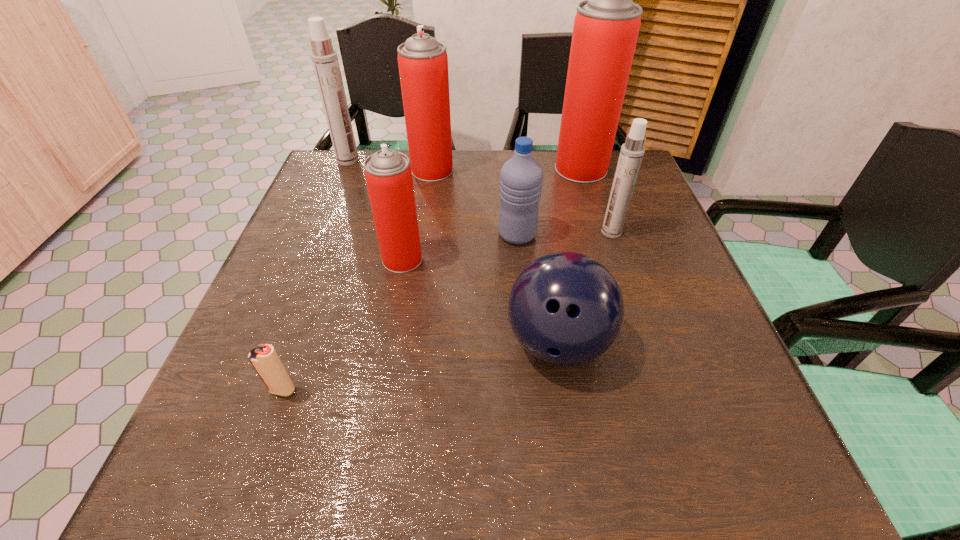
The image size is (960, 540). In order to click on vacant space at the far right corner of the desktop in this screenshot , I will do `click(644, 199)`.

I want to click on vacant space in between the seventh tallest object and the shortest object, so click(x=420, y=367).

Where is `free space between the shortest object and the nearest red aerosol can`? free space between the shortest object and the nearest red aerosol can is located at coordinates (343, 325).

At what (x,y) coordinates should I click in order to perform the action: click on blank region between the nearest aerosol can and the blue water bottle. Please return your answer as a coordinate pair (x, y). Image resolution: width=960 pixels, height=540 pixels. Looking at the image, I should click on (460, 247).

Identify the location of unoccupied position between the smallest red aerosol can and the blue water bottle. The image size is (960, 540). (460, 247).

Identify the location of vacant space that is in between the second shortest object and the bigger white aerosol can. The width and height of the screenshot is (960, 540). (453, 252).

Where is `vacant point located between the igniter and the blue water bottle`? vacant point located between the igniter and the blue water bottle is located at coordinates (399, 313).

This screenshot has height=540, width=960. I want to click on vacant point located between the blue bowling ball and the smallest red aerosol can, so click(x=480, y=301).

This screenshot has height=540, width=960. I want to click on object that is the fourth closest to the second biggest red aerosol can, so click(x=606, y=26).

The width and height of the screenshot is (960, 540). Find the location of `the closest object to the nearer white aerosol can`. the closest object to the nearer white aerosol can is located at coordinates (521, 177).